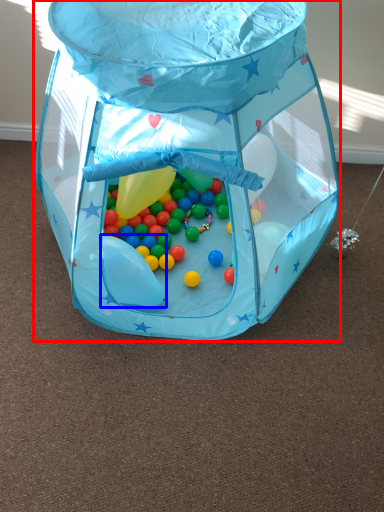
Question: Which object is further to the camera taking this photo, toy (highlighted by a red box) or balloon (highlighted by a blue box)?

Choices:
 (A) toy
 (B) balloon

Answer: (B)